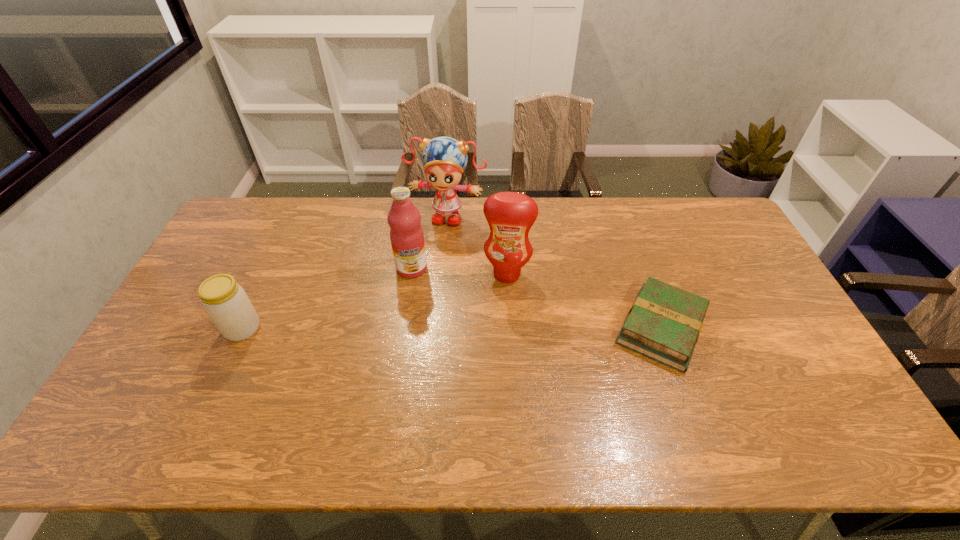
I want to click on vacant space on the desktop that is between the leftmost object and the rightmost object and is positioned on the label of the fruit juice, so coord(412,328).

Where is `free space on the desktop that is between the jar and the book and is positioned on the face of the farthest object`? The width and height of the screenshot is (960, 540). free space on the desktop that is between the jar and the book and is positioned on the face of the farthest object is located at coordinates (411, 328).

You are a GUI agent. You are given a task and a screenshot of the screen. Output one action in this format:
    pyautogui.click(x=<x>, y=<y>)
    Task: Click on the free space on the desktop that is between the leftmost object and the rightmost object and is positioned on the label side of the condiment
    The image size is (960, 540).
    Given the screenshot: What is the action you would take?
    pyautogui.click(x=498, y=328)